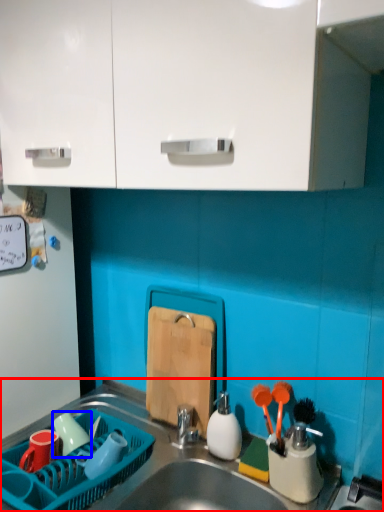
Question: Which point is closer to the camera, sink (highlighted by a red box) or tableware (highlighted by a blue box)?

Choices:
 (A) sink
 (B) tableware

Answer: (A)